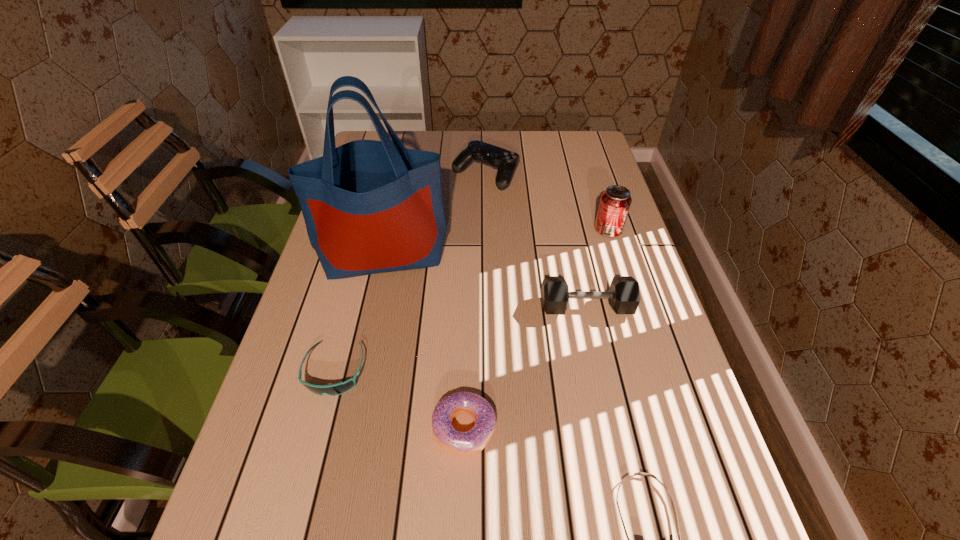
Find the location of a particular element. This screenshot has width=960, height=540. vacant point that satisfies the following two spatial constraints: 1. on the front side of the control; 2. on the left side of the dumbbell is located at coordinates (488, 308).